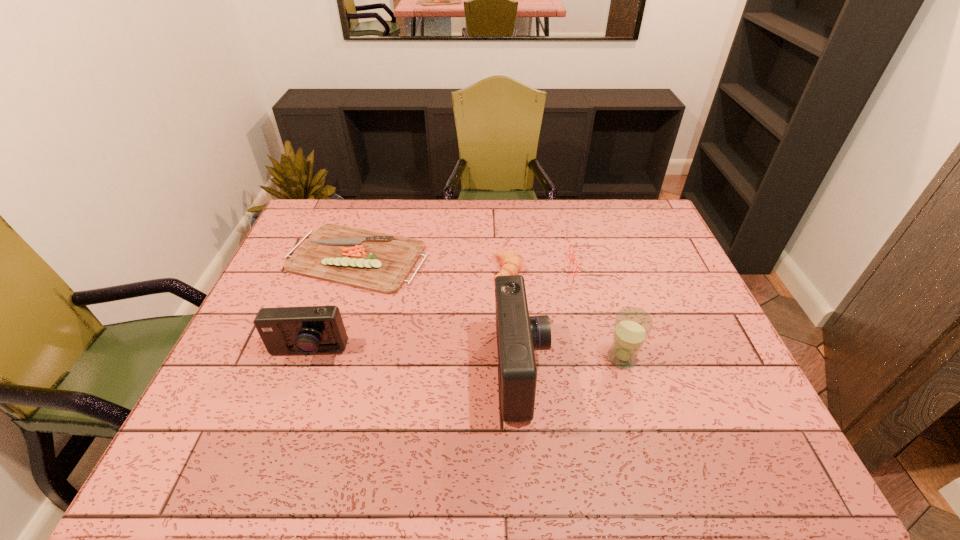
The width and height of the screenshot is (960, 540). I want to click on vacant space positioned on the front-facing side of the spectacles, so click(542, 267).

Find the location of a particular element. vacant region located 0.300m on the front-facing side of the spectacles is located at coordinates (475, 267).

Find the location of `vacant space located 0.130m on the front-facing side of the spectacles`. vacant space located 0.130m on the front-facing side of the spectacles is located at coordinates (530, 267).

Where is `vacant region located 0.330m on the right of the crescent roll`? This screenshot has width=960, height=540. vacant region located 0.330m on the right of the crescent roll is located at coordinates (628, 269).

Identify the location of vacant space located on the left of the glass. (451, 358).

Locate an element on the screen. The height and width of the screenshot is (540, 960). object present at the far edge is located at coordinates (378, 262).

Where is `object located at the near edge`? object located at the near edge is located at coordinates (518, 335).

Image resolution: width=960 pixels, height=540 pixels. I want to click on camera located at the left edge, so click(307, 330).

The height and width of the screenshot is (540, 960). I want to click on chopping board that is at the left edge, so 378,262.

The height and width of the screenshot is (540, 960). In order to click on object that is at the far left corner in this screenshot , I will do `click(378, 262)`.